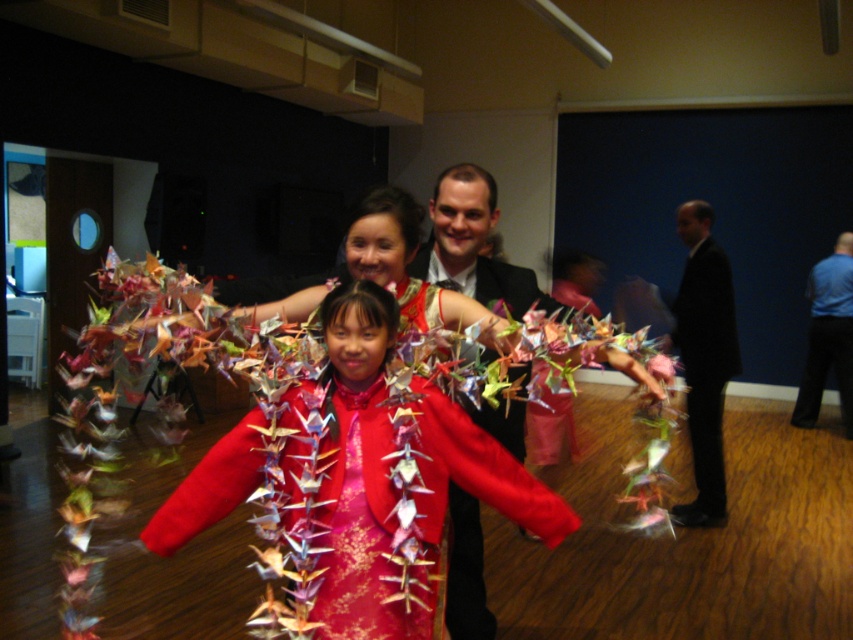
You are organizing a photo shoot and need to arrange the matte black suit at center and the blue smooth shirt at right based on their sizes. Which one should you place in a position that requires more space?

The matte black suit at center has a larger size compared to the blue smooth shirt at right, so it should be placed in a position that requires more space.

You are a photographer at the event and want to ensure the silky red dress at center and the black suit at right are both visible in the photo. Based on their positions, which one is closer to the camera?

The silky red dress at center is located above the black suit at right, meaning it is closer to the camera.

You are a photographer at the event and want to ensure the silky red dress at center and the matte black suit at center are both visible in the photo. Which one should you focus on first to ensure the other remains in the frame?

The silky red dress at center is located above the matte black suit at center, so focusing on the dress first will ensure the suit stays within the frame below it.